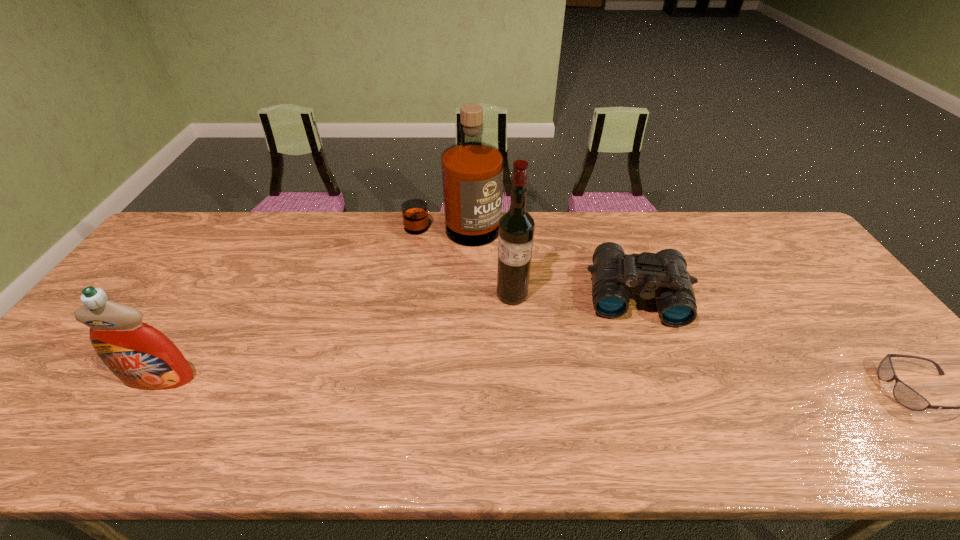
In order to click on free space on the desktop that is between the third shortest object and the rightmost object and is positioned on the front and back of the wine bottle in this screenshot , I will do `click(433, 382)`.

Locate an element on the screen. vacant space on the desktop that is between the detergent and the rightmost object and is positioned through the lenses of the second shortest object is located at coordinates (647, 386).

The width and height of the screenshot is (960, 540). What are the coordinates of `free spot on the desktop that is between the detergent and the sunglasses and is positioned on the front label of the liquor` in the screenshot? It's located at (451, 383).